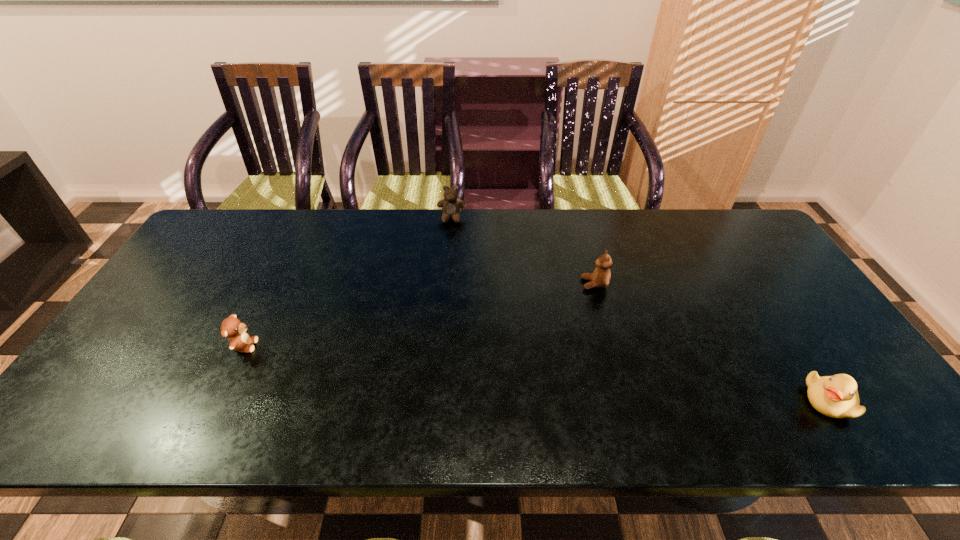
The image size is (960, 540). What are the coordinates of `blank area in the image that satisfies the following two spatial constraints: 1. on the face of the second teddy bear from right to left; 2. on the face of the leftmost object` in the screenshot? It's located at (442, 346).

Find the location of a particular element. free space that satisfies the following two spatial constraints: 1. on the face of the second teddy bear from right to left; 2. on the face of the leftmost object is located at coordinates (442, 346).